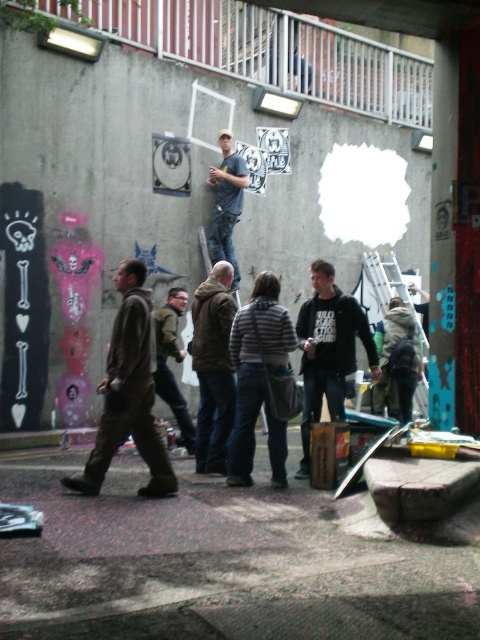
Question: Is black matte hoodie at center bigger than dark brown leather jacket at center?

Choices:
 (A) no
 (B) yes

Answer: (B)

Question: Can you confirm if blue denim jeans at center is positioned to the right of metallic silver ladder at center?

Choices:
 (A) no
 (B) yes

Answer: (A)

Question: Among these objects, which one is nearest to the camera?

Choices:
 (A) blue denim jeans at center
 (B) metallic silver ladder at center

Answer: (A)

Question: Which of the following is the farthest from the observer?

Choices:
 (A) dark brown leather jacket at center
 (B) black matte hoodie at center
 (C) green matte jacket at center

Answer: (C)

Question: Where is dark brown jacket at left located in relation to metallic silver ladder at center in the image?

Choices:
 (A) right
 (B) left

Answer: (B)

Question: Which object appears farthest from the camera in this image?

Choices:
 (A) dark brown jacket at left
 (B) dark brown leather jacket at center
 (C) blue denim jeans at center
 (D) black matte hoodie at center

Answer: (C)